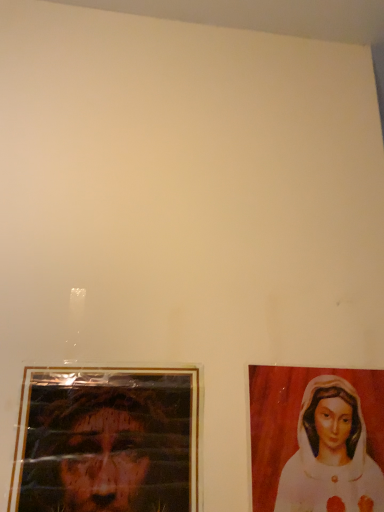
Image resolution: width=384 pixels, height=512 pixels. What do you see at coordinates (331, 454) in the screenshot?
I see `matte white painting of woman at right` at bounding box center [331, 454].

Locate an element on the screen. The width and height of the screenshot is (384, 512). matte white painting of woman at right is located at coordinates (331, 454).

Measure the distance between matte white painting of woman at right and camera.

They are 27.58 inches apart.

This screenshot has height=512, width=384. Describe the element at coordinates (107, 441) in the screenshot. I see `gold-framed photo at lower left` at that location.

I want to click on gold-framed photo at lower left, so click(107, 441).

Where is `matte white painting of woman at right`? Image resolution: width=384 pixels, height=512 pixels. matte white painting of woman at right is located at coordinates (331, 454).

Considering the positions of objects matte white painting of woman at right and gold-framed photo at lower left in the image provided, who is more to the right, matte white painting of woman at right or gold-framed photo at lower left?

Positioned to the right is matte white painting of woman at right.

Which object is further away from the camera taking this photo, matte white painting of woman at right or gold-framed photo at lower left?

matte white painting of woman at right is behind.

Which point is more distant from viewer, (336,407) or (52,464)?

The point (336,407) is farther.

In the scene shown: From the image's perspective, which object appears higher, matte white painting of woman at right or gold-framed photo at lower left?

gold-framed photo at lower left, from the image's perspective.

From a real-world perspective, who is located lower, matte white painting of woman at right or gold-framed photo at lower left?

gold-framed photo at lower left, from a real-world perspective.

Looking at this image, which of these two, matte white painting of woman at right or gold-framed photo at lower left, is wider?

gold-framed photo at lower left.

Considering the relative sizes of matte white painting of woman at right and gold-framed photo at lower left in the image provided, is matte white painting of woman at right shorter than gold-framed photo at lower left?

Yes.

Which of these two, matte white painting of woman at right or gold-framed photo at lower left, is smaller?

With smaller size is matte white painting of woman at right.

Can gold-framed photo at lower left be found inside matte white painting of woman at right?

No, gold-framed photo at lower left is not a part of matte white painting of woman at right.

Is matte white painting of woman at right in contact with gold-framed photo at lower left?

No, matte white painting of woman at right is not beside gold-framed photo at lower left.

Is matte white painting of woman at right oriented towards gold-framed photo at lower left?

No, matte white painting of woman at right is not aimed at gold-framed photo at lower left.

How many degrees apart are the facing directions of matte white painting of woman at right and gold-framed photo at lower left?

1.12 degrees.

Locate an element on the screen. This screenshot has height=512, width=384. picture frame on the left side of matte white painting of woman at right is located at coordinates (107, 441).

Is gold-framed photo at lower left at the right side of matte white painting of woman at right?

No.

Between gold-framed photo at lower left and matte white painting of woman at right, which one is positioned in front?

gold-framed photo at lower left.

Does point (61, 469) come behind point (350, 477)?

No.

From the image's perspective, is gold-framed photo at lower left located beneath matte white painting of woman at right?

No, from the image's perspective, gold-framed photo at lower left is not below matte white painting of woman at right.

From a real-world perspective, is gold-framed photo at lower left physically below matte white painting of woman at right?

Yes, from a real-world perspective, gold-framed photo at lower left is beneath matte white painting of woman at right.

Considering the relative sizes of gold-framed photo at lower left and matte white painting of woman at right in the image provided, is gold-framed photo at lower left wider than matte white painting of woman at right?

Correct, the width of gold-framed photo at lower left exceeds that of matte white painting of woman at right.

In terms of height, does gold-framed photo at lower left look taller or shorter compared to matte white painting of woman at right?

Considering their sizes, gold-framed photo at lower left has more height than matte white painting of woman at right.

Is gold-framed photo at lower left bigger than matte white painting of woman at right?

Yes.

Do you think gold-framed photo at lower left is within matte white painting of woman at right, or outside of it?

gold-framed photo at lower left is outside matte white painting of woman at right.

In the scene shown: Is gold-framed photo at lower left not near matte white painting of woman at right?

No, gold-framed photo at lower left is not far from matte white painting of woman at right.

Is gold-framed photo at lower left facing away from matte white painting of woman at right?

No, gold-framed photo at lower left is not facing away from matte white painting of woman at right.

Find the location of `picture frame that is on the left side of matte white painting of woman at right`. picture frame that is on the left side of matte white painting of woman at right is located at coordinates (107, 441).

I want to click on picture frame in front of the matte white painting of woman at right, so pos(107,441).

Where is `picture frame below the matte white painting of woman at right (from a real-world perspective)`? The height and width of the screenshot is (512, 384). picture frame below the matte white painting of woman at right (from a real-world perspective) is located at coordinates (107, 441).